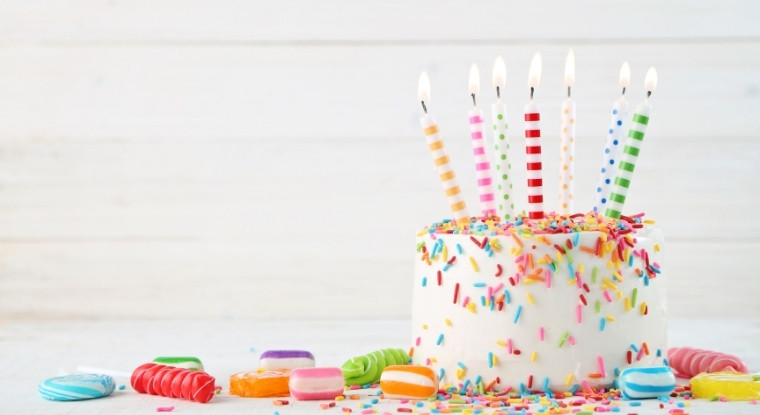
Locate an element on the screen. This screenshot has height=415, width=760. candle is located at coordinates [450, 188], [483, 186], [505, 182], [537, 183], [567, 179], [606, 172], [619, 184].